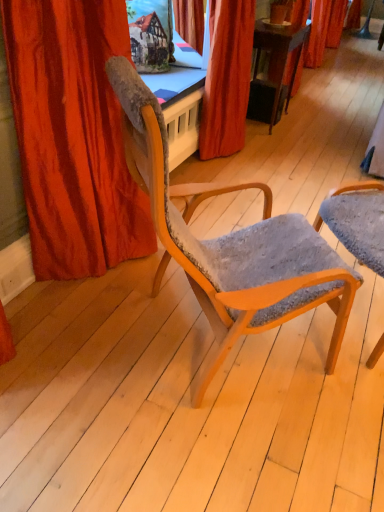
You are a GUI agent. You are given a task and a screenshot of the screen. Output one action in this format:
    pyautogui.click(x=<x>, y=<y>)
    Task: Click on the free point to the left of wooden chair with textured fabric at center, arranged as the 2th chair when viewed from the right
    
    Given the screenshot: What is the action you would take?
    pyautogui.click(x=68, y=356)